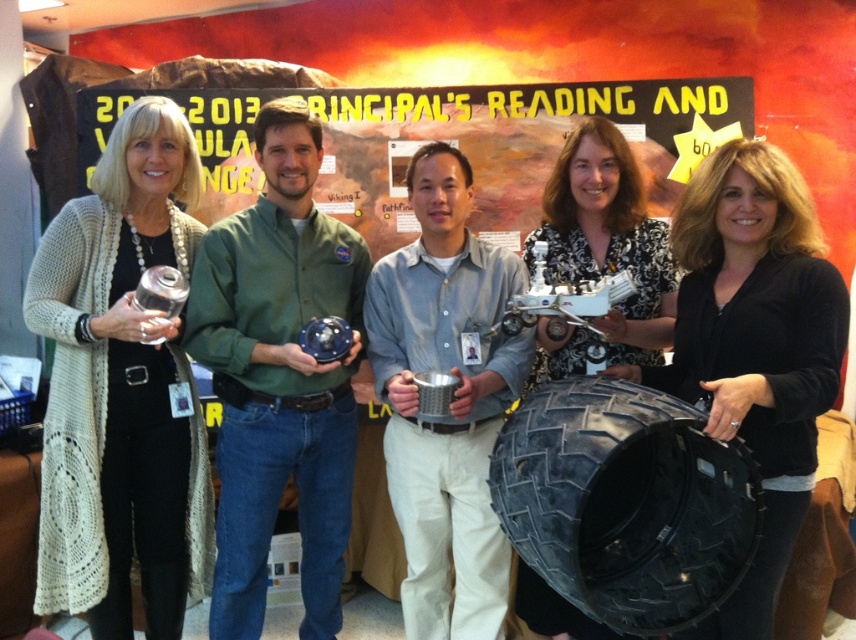
The height and width of the screenshot is (640, 856). I want to click on white knitted cardigan at left, so click(x=122, y=390).

Does point (64, 557) lie behind point (388, 452)?

No.

Measure the distance between point (153, 257) and camera.

They are 7.16 feet apart.

What are the coordinates of `white knitted cardigan at left` in the screenshot? It's located at (122, 390).

Between black matte tire at center and black floral blouse at center, which one appears on the left side from the viewer's perspective?

From the viewer's perspective, black floral blouse at center appears more on the left side.

Who is taller, black matte tire at center or black floral blouse at center?

black matte tire at center is taller.

Locate an element on the screen. Image resolution: width=856 pixels, height=640 pixels. black matte tire at center is located at coordinates (752, 346).

This screenshot has height=640, width=856. Identify the location of black matte tire at center. (752, 346).

Which is in front, point (843, 312) or point (434, 509)?

Point (843, 312) is in front.

Does black matte tire at center have a greater height compared to metallic silver cup at center?

In fact, black matte tire at center may be shorter than metallic silver cup at center.

Is point (755, 632) behind point (390, 353)?

No.

Find the location of a particular element. black matte tire at center is located at coordinates (752, 346).